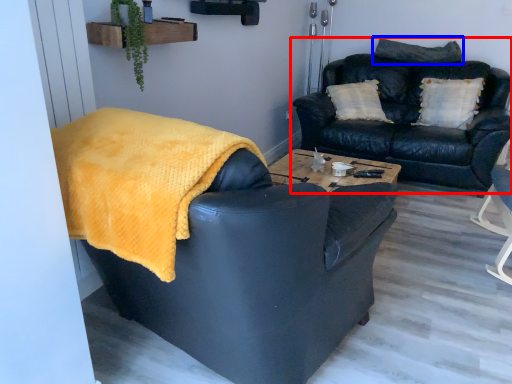
Question: Among these objects, which one is nearest to the camera, studio couch (highlighted by a red box) or pillow (highlighted by a blue box)?

Choices:
 (A) studio couch
 (B) pillow

Answer: (A)